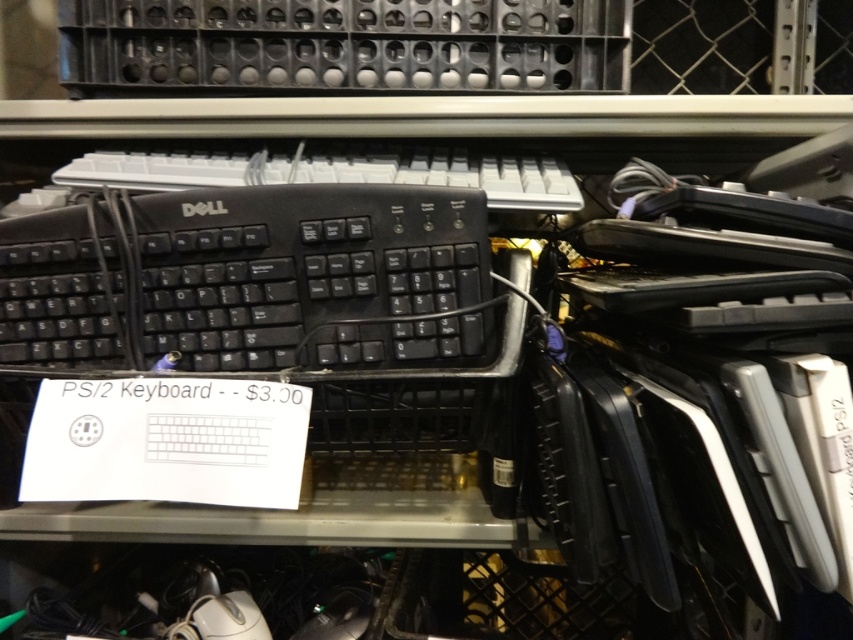
Can you confirm if white plastic keyboard at upper center is taller than white matte mouse at lower center?

Correct, white plastic keyboard at upper center is much taller as white matte mouse at lower center.

This screenshot has width=853, height=640. What do you see at coordinates (335, 172) in the screenshot?
I see `white plastic keyboard at upper center` at bounding box center [335, 172].

You are a GUI agent. You are given a task and a screenshot of the screen. Output one action in this format:
    pyautogui.click(x=<x>, y=<y>)
    Task: Click on the white plastic keyboard at upper center
    The image size is (853, 640).
    Given the screenshot: What is the action you would take?
    pyautogui.click(x=335, y=172)

Can you confirm if black matte keyboard at center is bigger than white matte mouse at lower center?

Yes.

This screenshot has width=853, height=640. I want to click on black matte keyboard at center, so coord(250,280).

Measure the distance between black matte keyboard at center and white plastic keyboard at upper center.

The distance of black matte keyboard at center from white plastic keyboard at upper center is 4.03 inches.

Does point (213, 209) come closer to viewer compared to point (177, 164)?

Yes, it is.

You are a GUI agent. You are given a task and a screenshot of the screen. Output one action in this format:
    pyautogui.click(x=<x>, y=<y>)
    Task: Click on the black matte keyboard at center
    This screenshot has height=640, width=853.
    Given the screenshot: What is the action you would take?
    pyautogui.click(x=250, y=280)